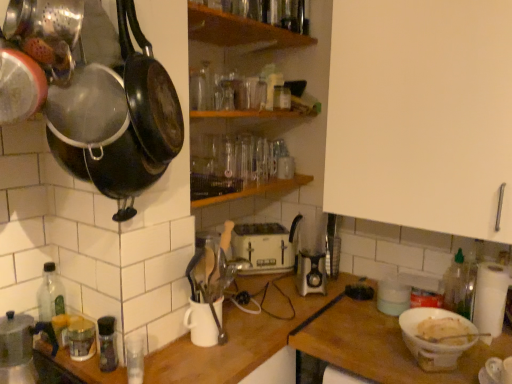
Question: From a real-world perspective, is green plastic bottle at right, which is counted as the 4th bottle, starting from the left, located higher than white matte cabinet at upper right?

Choices:
 (A) yes
 (B) no

Answer: (B)

Question: Is green plastic bottle at right, acting as the first bottle starting from the back, wider than white matte cabinet at upper right?

Choices:
 (A) yes
 (B) no

Answer: (B)

Question: Is green plastic bottle at right, the 4th bottle positioned from the front, facing towards white matte cabinet at upper right?

Choices:
 (A) yes
 (B) no

Answer: (B)

Question: Does green plastic bottle at right, the 4th bottle positioned from the front, appear on the right side of white matte cabinet at upper right?

Choices:
 (A) no
 (B) yes

Answer: (B)

Question: Is green plastic bottle at right, the 4th bottle positioned from the front, further to camera compared to white matte cabinet at upper right?

Choices:
 (A) yes
 (B) no

Answer: (A)

Question: Does green plastic bottle at right, acting as the first bottle starting from the back, have a lesser height compared to white matte cabinet at upper right?

Choices:
 (A) yes
 (B) no

Answer: (A)

Question: From the image's perspective, is white matte bowl at lower right, the 1th table viewed from the right, over wooden shelf at center, which ranks as the 1th shelf in bottom-to-top order?

Choices:
 (A) yes
 (B) no

Answer: (B)

Question: Is wooden shelf at center, which ranks as the 1th shelf in bottom-to-top order, at the back of white matte bowl at lower right, which ranks as the 2th table in left-to-right order?

Choices:
 (A) no
 (B) yes

Answer: (A)

Question: Does white matte bowl at lower right, which ranks as the 2th table in left-to-right order, contain wooden shelf at center, which is counted as the 2th shelf, starting from the top?

Choices:
 (A) yes
 (B) no

Answer: (B)

Question: Does white matte bowl at lower right, which ranks as the 2th table in left-to-right order, have a greater height compared to wooden shelf at center, which ranks as the 1th shelf in bottom-to-top order?

Choices:
 (A) no
 (B) yes

Answer: (B)

Question: From a real-world perspective, is white matte bowl at lower right, the 1th table viewed from the right, located higher than wooden shelf at center, which is counted as the 2th shelf, starting from the top?

Choices:
 (A) yes
 (B) no

Answer: (B)

Question: Is white matte bowl at lower right, the 1th table viewed from the right, oriented towards wooden shelf at center, which ranks as the 1th shelf in bottom-to-top order?

Choices:
 (A) yes
 (B) no

Answer: (B)

Question: Does white matte bowl at lower right have a greater height compared to wooden shelf at center, which ranks as the 1th shelf in bottom-to-top order?

Choices:
 (A) no
 (B) yes

Answer: (B)